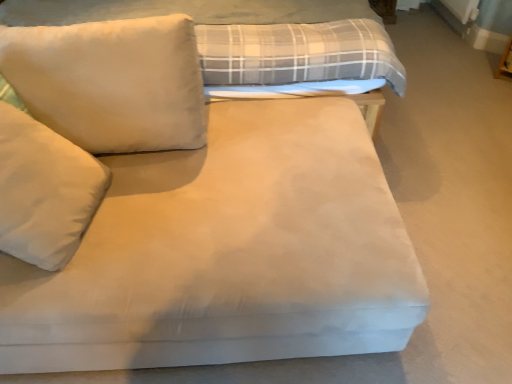
In order to face suede-like beige bed at center, should I rotate leftwards or rightwards?

Rotate your view left by about 7.781°.

Image resolution: width=512 pixels, height=384 pixels. Find the location of `suede-like beige bed at center`. suede-like beige bed at center is located at coordinates (252, 37).

Can you tell me how much white soft pillow at upper left, placed as the 2th pillow when sorted from bottom to top, and white soft pillow at left, the first pillow ordered from the bottom, differ in facing direction?

There is a 78.1-degree angle between the facing directions of white soft pillow at upper left, placed as the 2th pillow when sorted from bottom to top, and white soft pillow at left, the first pillow ordered from the bottom.

In the scene shown: Who is taller, white soft pillow at upper left, marked as the first pillow in a top-to-bottom arrangement, or white soft pillow at left, the 2th pillow when ordered from top to bottom?

With more height is white soft pillow at left, the 2th pillow when ordered from top to bottom.

Between white soft pillow at upper left, marked as the first pillow in a top-to-bottom arrangement, and white soft pillow at left, the first pillow ordered from the bottom, which one has smaller size?

With smaller size is white soft pillow at left, the first pillow ordered from the bottom.

From the image's perspective, between white soft pillow at upper left, marked as the first pillow in a top-to-bottom arrangement, and white soft pillow at left, the 2th pillow when ordered from top to bottom, which one is located above?

white soft pillow at upper left, marked as the first pillow in a top-to-bottom arrangement.

Based on the photo, which is more to the left, white soft pillow at upper left, marked as the first pillow in a top-to-bottom arrangement, or suede-like beige bed at center?

white soft pillow at upper left, marked as the first pillow in a top-to-bottom arrangement.

From the image's perspective, does white soft pillow at upper left, marked as the first pillow in a top-to-bottom arrangement, appear lower than suede-like beige bed at center?

Correct, white soft pillow at upper left, marked as the first pillow in a top-to-bottom arrangement, appears lower than suede-like beige bed at center in the image.

Is suede-like beige bed at center completely or partially inside white soft pillow at upper left, marked as the first pillow in a top-to-bottom arrangement?

No, suede-like beige bed at center is not inside white soft pillow at upper left, marked as the first pillow in a top-to-bottom arrangement.

Which point is more forward, (5, 162) or (114, 54)?

Point (5, 162)

From the image's perspective, is white soft pillow at left, the 2th pillow when ordered from top to bottom, located above or below white soft pillow at upper left, marked as the first pillow in a top-to-bottom arrangement?

white soft pillow at left, the 2th pillow when ordered from top to bottom, is below white soft pillow at upper left, marked as the first pillow in a top-to-bottom arrangement.

Would you say white soft pillow at left, the 2th pillow when ordered from top to bottom, is a long distance from white soft pillow at upper left, placed as the 2th pillow when sorted from bottom to top?

They are positioned close to each other.

In the image, is white soft pillow at left, the first pillow ordered from the bottom, positioned in front of or behind white soft pillow at upper left, placed as the 2th pillow when sorted from bottom to top?

white soft pillow at left, the first pillow ordered from the bottom, is in front of white soft pillow at upper left, placed as the 2th pillow when sorted from bottom to top.

Does suede-like beige bed at center lie behind white soft pillow at left, the first pillow ordered from the bottom?

Yes, suede-like beige bed at center is behind white soft pillow at left, the first pillow ordered from the bottom.

Between suede-like beige bed at center and white soft pillow at left, the first pillow ordered from the bottom, which one has less height?

Standing shorter between the two is white soft pillow at left, the first pillow ordered from the bottom.

In terms of width, does suede-like beige bed at center look wider or thinner when compared to white soft pillow at left, the 2th pillow when ordered from top to bottom?

In the image, suede-like beige bed at center appears to be wider than white soft pillow at left, the 2th pillow when ordered from top to bottom.

From a real-world perspective, does suede-like beige bed at center stand above white soft pillow at upper left, placed as the 2th pillow when sorted from bottom to top?

No, from a real-world perspective, suede-like beige bed at center is not on top of white soft pillow at upper left, placed as the 2th pillow when sorted from bottom to top.

Is suede-like beige bed at center far away from white soft pillow at upper left, placed as the 2th pillow when sorted from bottom to top?

suede-like beige bed at center is near white soft pillow at upper left, placed as the 2th pillow when sorted from bottom to top, not far away.

Measure the distance from suede-like beige bed at center to white soft pillow at upper left, marked as the first pillow in a top-to-bottom arrangement.

suede-like beige bed at center is 22.99 inches away from white soft pillow at upper left, marked as the first pillow in a top-to-bottom arrangement.

Which of these two, suede-like beige bed at center or white soft pillow at upper left, placed as the 2th pillow when sorted from bottom to top, is wider?

Wider between the two is suede-like beige bed at center.

Is point (75, 202) positioned in front of point (279, 81)?

Yes, point (75, 202) is in front of point (279, 81).

Can suede-like beige bed at center be found inside white soft pillow at left, the first pillow ordered from the bottom?

No.

Which object is thinner, white soft pillow at left, the first pillow ordered from the bottom, or suede-like beige bed at center?

Thinner between the two is white soft pillow at left, the first pillow ordered from the bottom.

Which is more to the right, white soft pillow at left, the 2th pillow when ordered from top to bottom, or suede-like beige bed at center?

From the viewer's perspective, suede-like beige bed at center appears more on the right side.

Find the location of a particular element. pillow in front of the white soft pillow at upper left, marked as the first pillow in a top-to-bottom arrangement is located at coordinates (44, 191).

Find the location of `bed on the right of white soft pillow at upper left, marked as the first pillow in a top-to-bottom arrangement`. bed on the right of white soft pillow at upper left, marked as the first pillow in a top-to-bottom arrangement is located at coordinates (252, 37).

From the image, which object appears to be nearer to white soft pillow at left, the 2th pillow when ordered from top to bottom, suede-like beige bed at center or white soft pillow at upper left, placed as the 2th pillow when sorted from bottom to top?

white soft pillow at upper left, placed as the 2th pillow when sorted from bottom to top.

Estimate the real-world distances between objects in this image. Which object is closer to white soft pillow at upper left, placed as the 2th pillow when sorted from bottom to top, white soft pillow at left, the 2th pillow when ordered from top to bottom, or suede-like beige bed at center?

white soft pillow at left, the 2th pillow when ordered from top to bottom, is positioned closer to the anchor white soft pillow at upper left, placed as the 2th pillow when sorted from bottom to top.

From the image, which object appears to be nearer to suede-like beige bed at center, white soft pillow at left, the first pillow ordered from the bottom, or white soft pillow at upper left, placed as the 2th pillow when sorted from bottom to top?

white soft pillow at upper left, placed as the 2th pillow when sorted from bottom to top, is closer to suede-like beige bed at center.

Estimate the real-world distances between objects in this image. Which object is further from white soft pillow at upper left, placed as the 2th pillow when sorted from bottom to top, suede-like beige bed at center or white soft pillow at left, the first pillow ordered from the bottom?

Based on the image, suede-like beige bed at center appears to be further to white soft pillow at upper left, placed as the 2th pillow when sorted from bottom to top.

Looking at the image, which one is located closer to suede-like beige bed at center, white soft pillow at upper left, placed as the 2th pillow when sorted from bottom to top, or white soft pillow at left, the first pillow ordered from the bottom?

Based on the image, white soft pillow at upper left, placed as the 2th pillow when sorted from bottom to top, appears to be nearer to suede-like beige bed at center.

Consider the image. Considering their positions, is white soft pillow at upper left, marked as the first pillow in a top-to-bottom arrangement, positioned closer to white soft pillow at left, the first pillow ordered from the bottom, than suede-like beige bed at center?

white soft pillow at upper left, marked as the first pillow in a top-to-bottom arrangement, is positioned closer to the anchor white soft pillow at left, the first pillow ordered from the bottom.

Where is `pillow between suede-like beige bed at center and white soft pillow at left, the first pillow ordered from the bottom, in the up-down direction`? The image size is (512, 384). pillow between suede-like beige bed at center and white soft pillow at left, the first pillow ordered from the bottom, in the up-down direction is located at coordinates (111, 82).